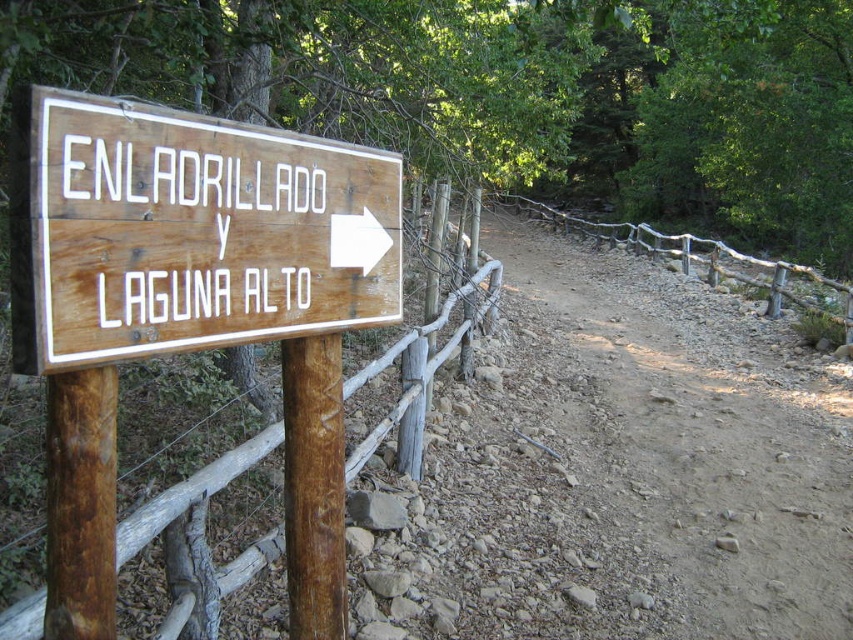
You are standing on the dirt path and see the wooden sign at left and the wooden fence at left. Which one is nearer to you?

The wooden sign at left is closer to the viewer than the wooden fence at left, so the wooden sign at left is nearer to you.

You are a hiker walking along the dirt path and see the wooden sign at left and the wooden fence at left. Which object is closer to the path?

The wooden sign at left is closer to the path because it is positioned under the wooden fence at left, meaning it is in front of the fence and thus nearer to the path.

From the picture: You are a hiker who wants to take a photo of the wooden fence at left and the brown wood post at left. Which object should you focus on first if you want to capture both in a single frame without moving the camera? Explain your reasoning based on their sizes and positions.

The wooden fence at left is larger in size than the brown wood post at left. Since the wooden fence at left is larger, it would occupy more space in the frame. To include both objects without moving the camera, you should focus on the wooden fence at left first as it requires more attention due to its size, ensuring it fits properly before adjusting the composition to include the smaller brown wood post at left.